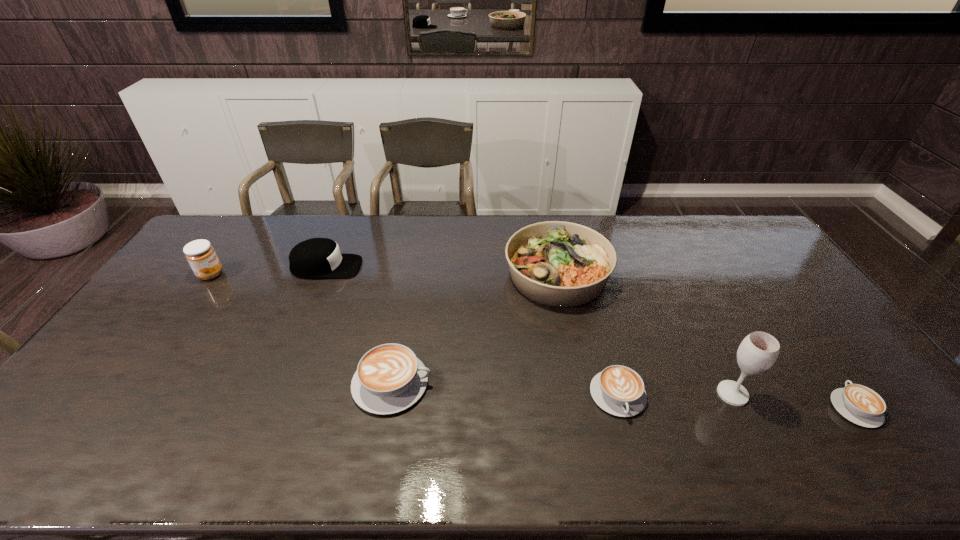
This screenshot has width=960, height=540. Identify the location of the second object from right to left. coord(758,351).

At what (x,y) coordinates should I click in order to perform the action: click on vacant space situated on the side of the fifth tallest object with the handle. Please return your answer as a coordinate pair (x, y). Looking at the image, I should click on (485, 383).

Where is `vacant point located on the side of the shortest object with the handle`? This screenshot has height=540, width=960. vacant point located on the side of the shortest object with the handle is located at coordinates (797, 328).

Where is `vacant space situated 0.400m on the side of the shortest object with the handle`? vacant space situated 0.400m on the side of the shortest object with the handle is located at coordinates (766, 285).

Identify the location of free space located 0.200m on the side of the shortest object with the handle. This screenshot has width=960, height=540. (799, 330).

Where is `free space located on the front label of the jam`? This screenshot has height=540, width=960. free space located on the front label of the jam is located at coordinates (250, 274).

You are a GUI agent. You are given a task and a screenshot of the screen. Output one action in this format:
    pyautogui.click(x=<x>, y=<y>)
    Task: Click on the free space located on the left of the salad plate
    The height and width of the screenshot is (540, 960).
    Given the screenshot: What is the action you would take?
    pyautogui.click(x=434, y=274)

At what (x,y) coordinates should I click in order to perform the action: click on vacant space located on the front-facing side of the cap. Please return your answer as a coordinate pair (x, y). Image resolution: width=960 pixels, height=540 pixels. Looking at the image, I should click on (393, 267).

Find the location of `vacant region located on the right of the sixth object from left to right`. vacant region located on the right of the sixth object from left to right is located at coordinates (767, 394).

Find the location of `object positioned at the far edge`. object positioned at the far edge is located at coordinates (556, 263).